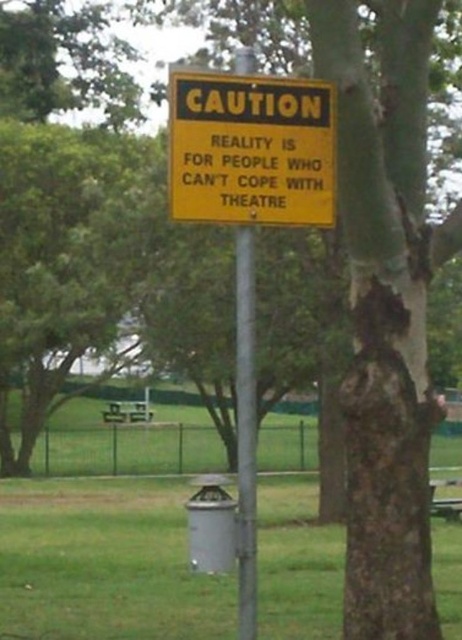
Question: Which point is closer to the camera?

Choices:
 (A) metallic pole at center
 (B) green plastic picnic table at lower right
 (C) yellow paper sign at center

Answer: (A)

Question: Does yellow paper sign at center have a smaller size compared to metallic pole at center?

Choices:
 (A) yes
 (B) no

Answer: (A)

Question: Which point is closer to the camera?

Choices:
 (A) (439, 499)
 (B) (238, 508)
 (C) (259, 96)

Answer: (C)

Question: Observing the image, what is the correct spatial positioning of metallic pole at center in reference to green plastic picnic table at lower right?

Choices:
 (A) right
 (B) left

Answer: (B)

Question: Which of the following is the farthest from the observer?

Choices:
 (A) metallic pole at center
 (B) green plastic picnic table at lower right

Answer: (B)

Question: Can you confirm if yellow paper sign at center is thinner than metallic pole at center?

Choices:
 (A) yes
 (B) no

Answer: (B)